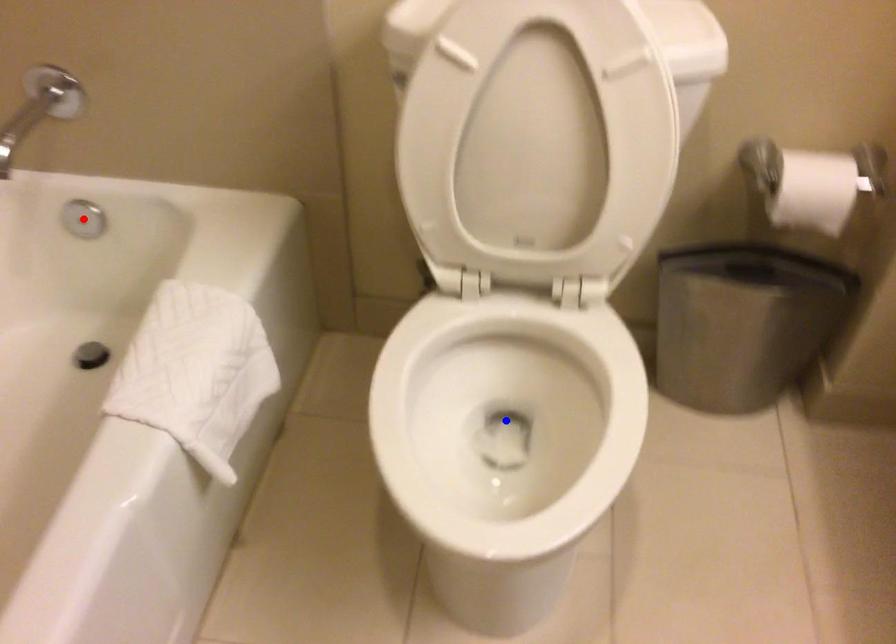
Question: In the image, two points are highlighted. Which point is nearer to the camera? Reply with the corresponding letter.

Choices:
 (A) blue point
 (B) red point

Answer: (A)